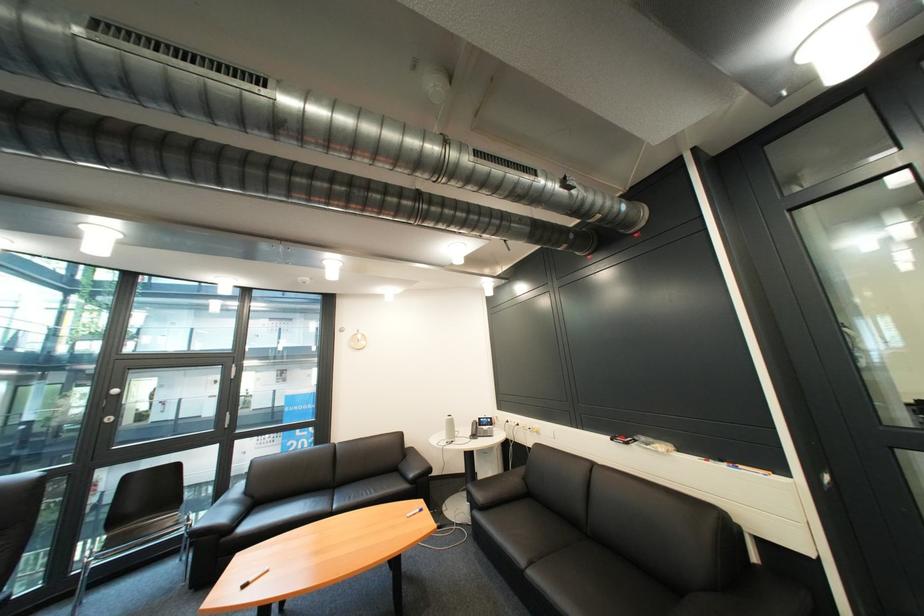
The image size is (924, 616). What do you see at coordinates (108, 411) in the screenshot? I see `the silver window handle` at bounding box center [108, 411].